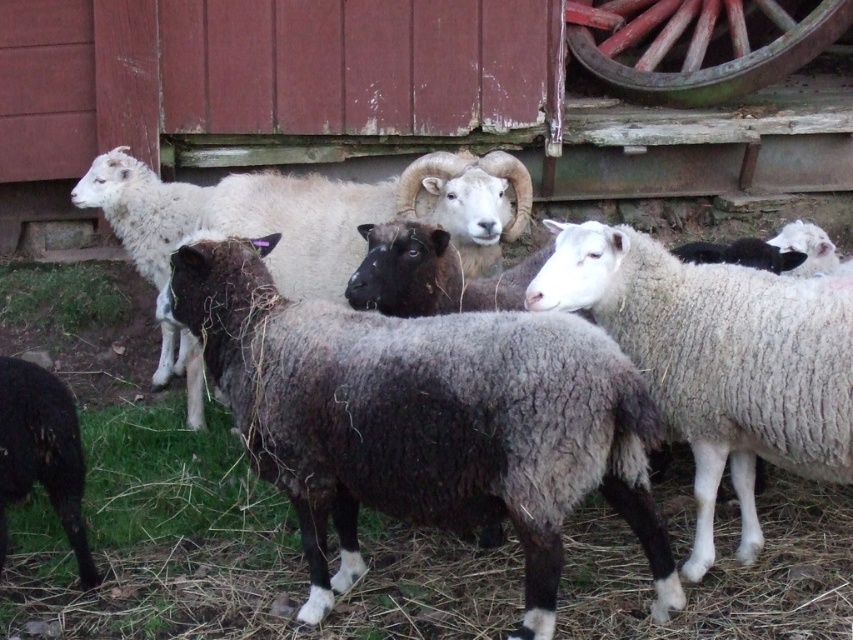
Who is shorter, dark gray woolly sheep at center or white woolly sheep at center?

dark gray woolly sheep at center

Measure the distance between dark gray woolly sheep at center and white woolly sheep at center.

A distance of 26.19 inches exists between dark gray woolly sheep at center and white woolly sheep at center.

What do you see at coordinates (254, 548) in the screenshot?
I see `dark gray woolly sheep at center` at bounding box center [254, 548].

The image size is (853, 640). What are the coordinates of `dark gray woolly sheep at center` in the screenshot? It's located at (254, 548).

Looking at this image, can you confirm if dark gray woolly sheep at center is positioned to the right of green fuzzy grass at lower left?

Yes, dark gray woolly sheep at center is to the right of green fuzzy grass at lower left.

The height and width of the screenshot is (640, 853). What do you see at coordinates (254, 548) in the screenshot? I see `dark gray woolly sheep at center` at bounding box center [254, 548].

The height and width of the screenshot is (640, 853). In order to click on dark gray woolly sheep at center in this screenshot , I will do `click(254, 548)`.

Who is positioned more to the right, dark gray woolly sheep at center or rustic wood wagon wheel at upper right?

rustic wood wagon wheel at upper right is more to the right.

Is dark gray woolly sheep at center to the right of rustic wood wagon wheel at upper right from the viewer's perspective?

No, dark gray woolly sheep at center is not to the right of rustic wood wagon wheel at upper right.

Is point (258, 536) behind point (759, 80)?

No, it is in front of (759, 80).

In order to click on dark gray woolly sheep at center in this screenshot , I will do `click(254, 548)`.